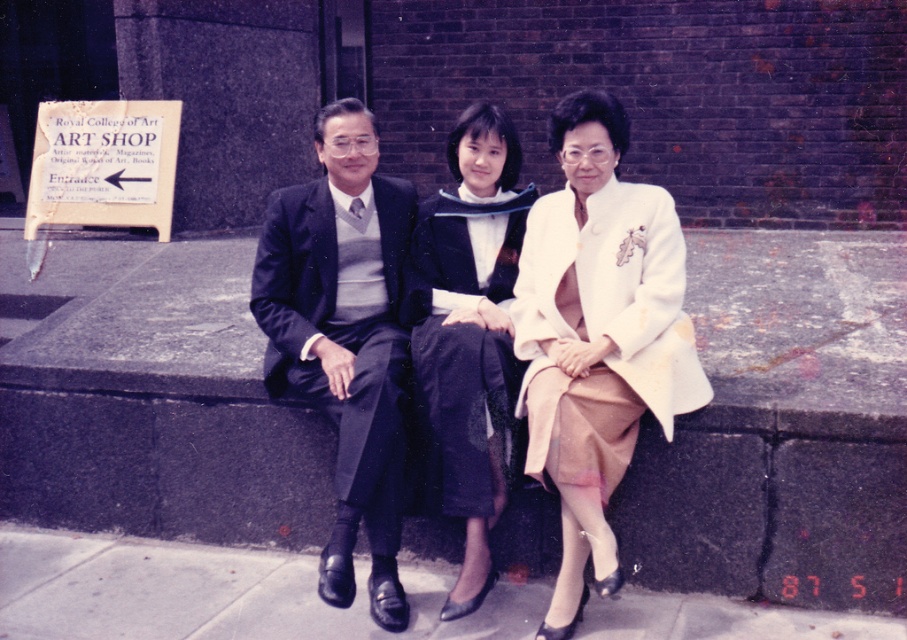
You are standing at the point marked by the coordinates point [216,593]. Looking around, you see three people sitting on a low stone wall. The woman in the center is wearing a black outfit. What is the surface you are standing on at this location?

The surface at point [216,593] is the smooth concrete pavement at lower center.